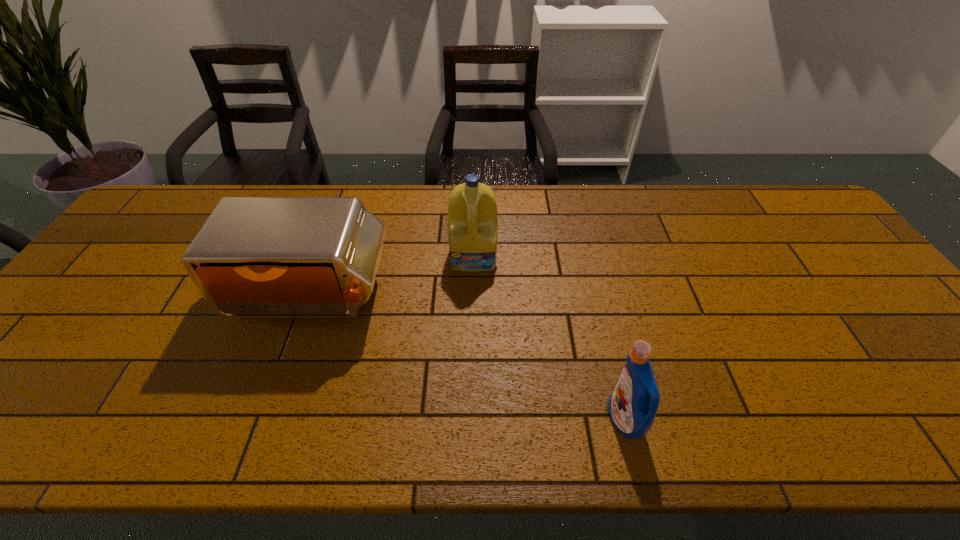
In order to click on object that is at the near edge in this screenshot , I will do 632,406.

Locate an element on the screen. vacant space at the far edge is located at coordinates (651, 206).

The height and width of the screenshot is (540, 960). In order to click on vacant region at the near edge of the desktop in this screenshot , I will do `click(743, 427)`.

Where is `free space at the left edge of the desktop`? This screenshot has width=960, height=540. free space at the left edge of the desktop is located at coordinates (153, 270).

Where is `vacant region at the right edge of the desktop`? This screenshot has width=960, height=540. vacant region at the right edge of the desktop is located at coordinates (872, 282).

Identify the location of vacant region at the far left corner. (188, 221).

Where is `blank region between the toaster oven and the rightmost object`? blank region between the toaster oven and the rightmost object is located at coordinates (468, 358).

You are a GUI agent. You are given a task and a screenshot of the screen. Output one action in this format:
    pyautogui.click(x=<x>, y=<y>)
    Task: Click on the vacant space that is in between the leftmost object and the right detergent
    Image resolution: width=960 pixels, height=540 pixels.
    Given the screenshot: What is the action you would take?
    pos(468,358)

This screenshot has width=960, height=540. I want to click on free spot between the leftmost object and the left detergent, so click(x=393, y=276).

You are a GUI agent. You are given a task and a screenshot of the screen. Output one action in this format:
    pyautogui.click(x=<x>, y=<y>)
    Task: Click on the free space between the shorter detergent and the leftmost object
    This screenshot has width=960, height=540.
    Given the screenshot: What is the action you would take?
    pyautogui.click(x=468, y=358)